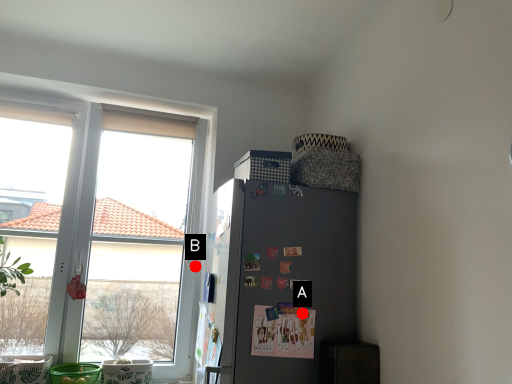
Question: Two points are circled on the image, labeled by A and B beside each circle. Which point is farther to the camera?

Choices:
 (A) A is further
 (B) B is further

Answer: (B)